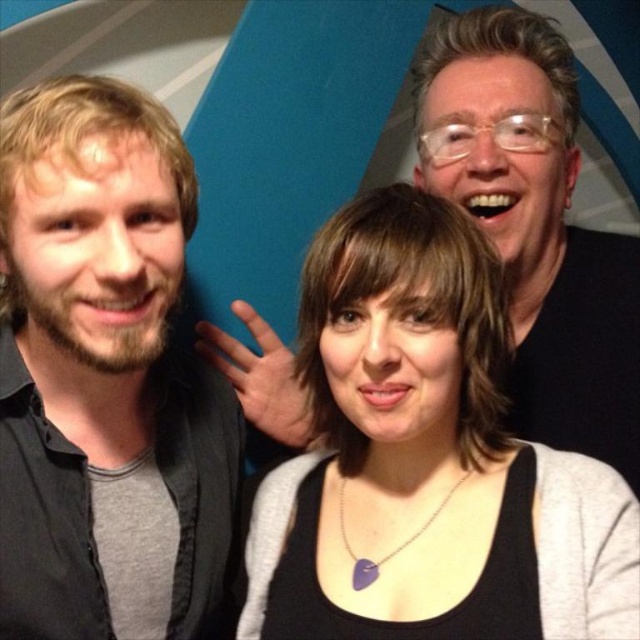
Based on the photo, is black matte necklace at center closer to the viewer compared to matte black shirt at left?

Yes, black matte necklace at center is in front of matte black shirt at left.

Is black matte necklace at center wider than matte black shirt at left?

Yes, black matte necklace at center is wider than matte black shirt at left.

The image size is (640, 640). In order to click on black matte necklace at center in this screenshot , I will do `click(426, 458)`.

The height and width of the screenshot is (640, 640). I want to click on black matte necklace at center, so click(426, 458).

Locate an element on the screen. black matte necklace at center is located at coordinates (426, 458).

Between point (506, 602) and point (536, 138), which one is positioned in front?

Point (506, 602) is in front.

The width and height of the screenshot is (640, 640). What do you see at coordinates (426, 458) in the screenshot?
I see `black matte necklace at center` at bounding box center [426, 458].

The height and width of the screenshot is (640, 640). What are the coordinates of `black matte necklace at center` in the screenshot? It's located at (426, 458).

Who is more forward, (40, 548) or (532, 298)?

Point (40, 548) is in front.

Can you confirm if matte black shirt at left is positioned below matte black shirt at upper right?

Yes, matte black shirt at left is below matte black shirt at upper right.

Locate an element on the screen. Image resolution: width=640 pixels, height=640 pixels. matte black shirt at left is located at coordinates (100, 369).